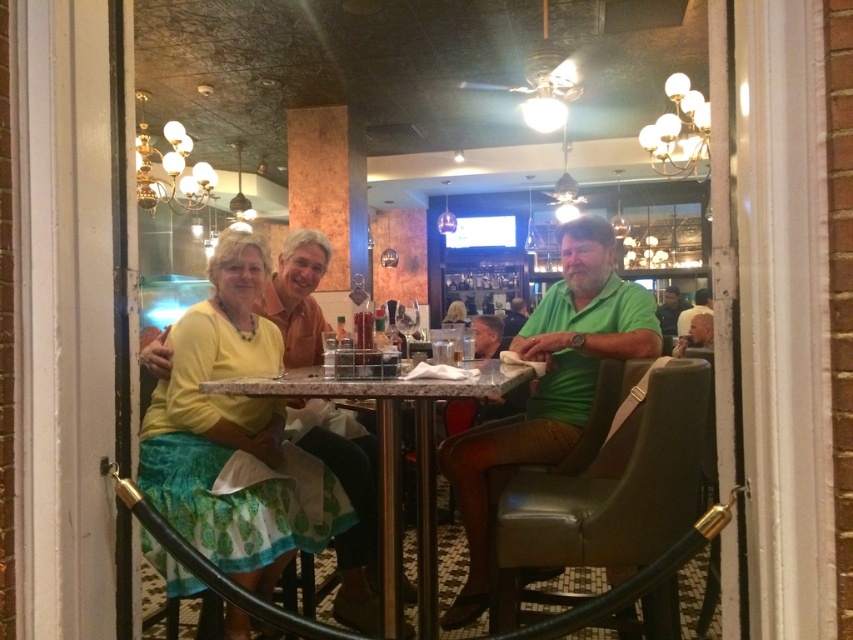
Question: Among these objects, which one is nearest to the camera?

Choices:
 (A) green cotton shirt at right
 (B) green fabric shirt at center
 (C) green matte shirt at center

Answer: (C)

Question: Estimate the real-world distances between objects in this image. Which object is closer to the green cotton shirt at right?

Choices:
 (A) yellow fabric dress at center
 (B) green matte shirt at center
 (C) green fabric shirt at center

Answer: (C)

Question: Can you confirm if green matte shirt at center is bigger than green cotton shirt at right?

Choices:
 (A) yes
 (B) no

Answer: (B)

Question: Which of the following is the closest to the observer?

Choices:
 (A) green cotton shirt at right
 (B) matte green shirt at center

Answer: (B)

Question: Where is yellow fabric dress at center located in relation to marble table at center in the image?

Choices:
 (A) below
 (B) above

Answer: (B)

Question: Is green matte shirt at center smaller than matte green shirt at center?

Choices:
 (A) yes
 (B) no

Answer: (A)